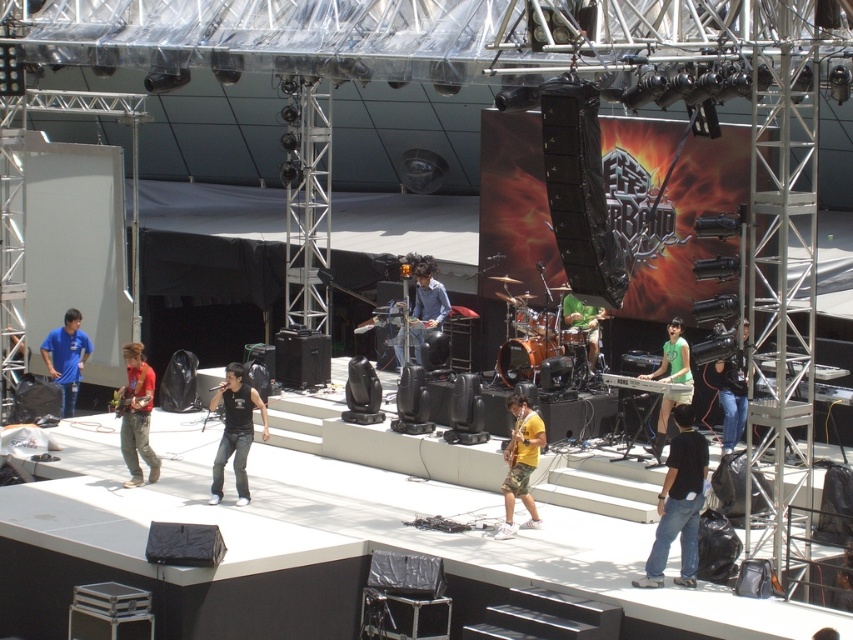
Question: Does black leather pants at center appear on the left side of black leather jacket at right?

Choices:
 (A) yes
 (B) no

Answer: (A)

Question: Which of these objects is positioned farthest from the red cotton shirt at center?

Choices:
 (A) green matte keyboard at center
 (B) black leather jacket at right
 (C) black leather pants at center
 (D) black cotton shirt at center

Answer: (B)

Question: Can you confirm if black cotton shirt at center is thinner than red cotton shirt at center?

Choices:
 (A) no
 (B) yes

Answer: (A)

Question: Is red cotton shirt at center to the right of yellow matte shirt at center from the viewer's perspective?

Choices:
 (A) yes
 (B) no

Answer: (B)

Question: Which object is positioned closest to the green matte keyboard at center?

Choices:
 (A) yellow matte shirt at center
 (B) green fabric drum at center
 (C) black leather jacket at right

Answer: (C)

Question: Which object is the farthest from the green matte keyboard at center?

Choices:
 (A) green fabric drum at center
 (B) black cotton shirt at center
 (C) matte blue shirt at center

Answer: (C)